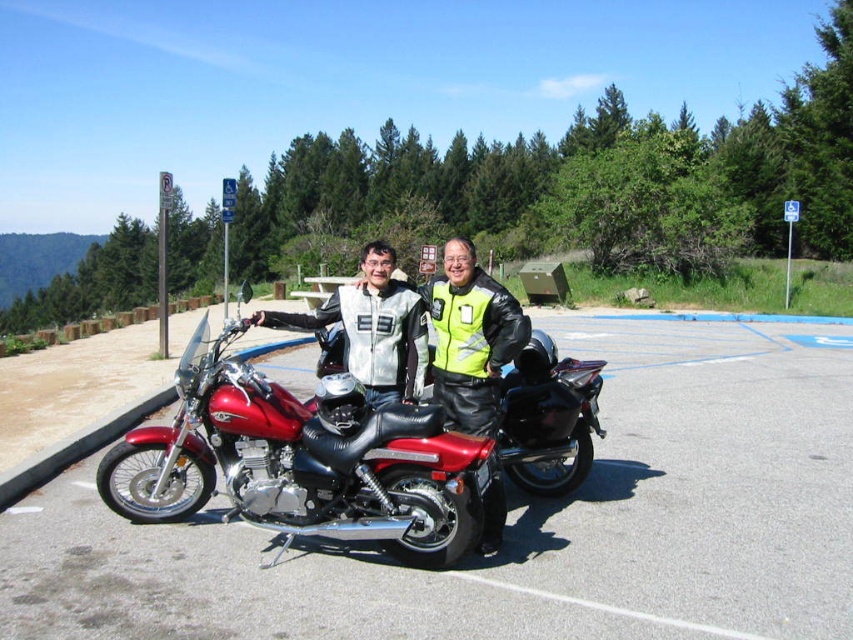
Question: Can you confirm if shiny red motorcycle at center is positioned above matte black motorcycle at center?

Choices:
 (A) no
 (B) yes

Answer: (A)

Question: Among these points, which one is nearest to the camera?

Choices:
 (A) (97, 540)
 (B) (297, 432)

Answer: (B)

Question: Does metallic red motorcycle at center appear under matte black motorcycle at center?

Choices:
 (A) no
 (B) yes

Answer: (B)

Question: Considering the real-world distances, which object is closest to the shiny red motorcycle at center?

Choices:
 (A) matte black motorcycle at center
 (B) metallic red motorcycle at center

Answer: (A)

Question: Which point is closer to the camera?

Choices:
 (A) matte black motorcycle at center
 (B) metallic red motorcycle at center
 (C) shiny red motorcycle at center

Answer: (B)

Question: In this image, where is metallic red motorcycle at center located relative to matte black motorcycle at center?

Choices:
 (A) below
 (B) above

Answer: (A)